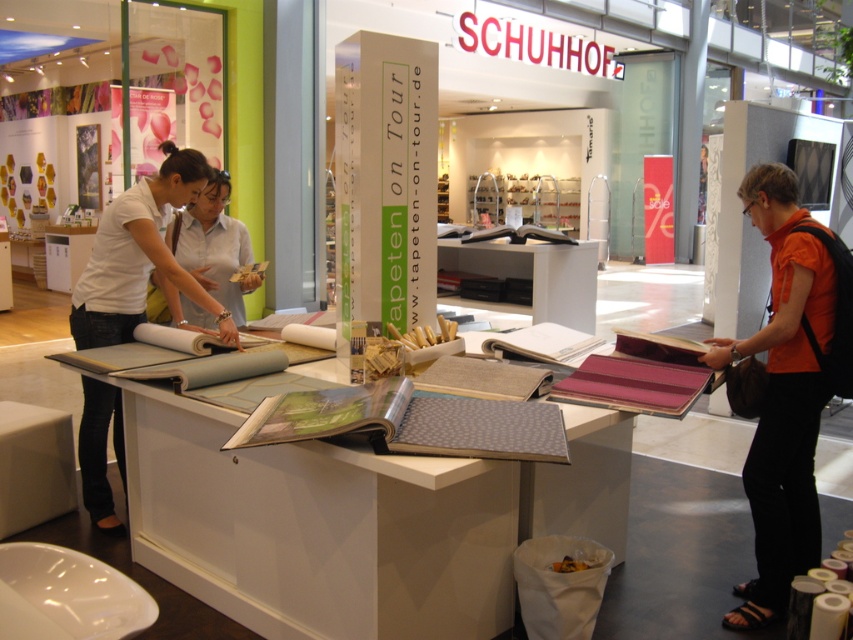
Question: Is matte white blouse at left positioned before white fabric at center?

Choices:
 (A) yes
 (B) no

Answer: (A)

Question: Observing the image, what is the correct spatial positioning of orange fabric shirt at right in reference to matte white blouse at left?

Choices:
 (A) left
 (B) right

Answer: (B)

Question: Is orange fabric shirt at right positioned in front of matte white blouse at left?

Choices:
 (A) no
 (B) yes

Answer: (B)

Question: Which point appears farthest from the camera in this image?

Choices:
 (A) (86, 284)
 (B) (801, 557)
 (C) (224, 198)

Answer: (C)

Question: Which object is closer to the camera taking this photo?

Choices:
 (A) white fabric at center
 (B) matte white blouse at left

Answer: (B)

Question: Which object appears farthest from the camera in this image?

Choices:
 (A) white fabric at center
 (B) matte white blouse at left
 (C) orange fabric shirt at right

Answer: (A)